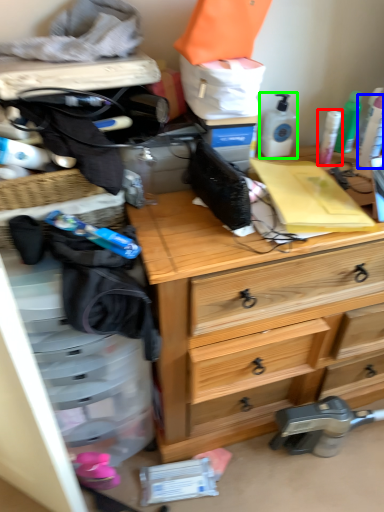
Question: Estimate the real-world distances between objects in this image. Which object is farther from toiletry (highlighted by a red box), toiletry (highlighted by a blue box) or toiletry (highlighted by a green box)?

Choices:
 (A) toiletry
 (B) toiletry

Answer: (B)